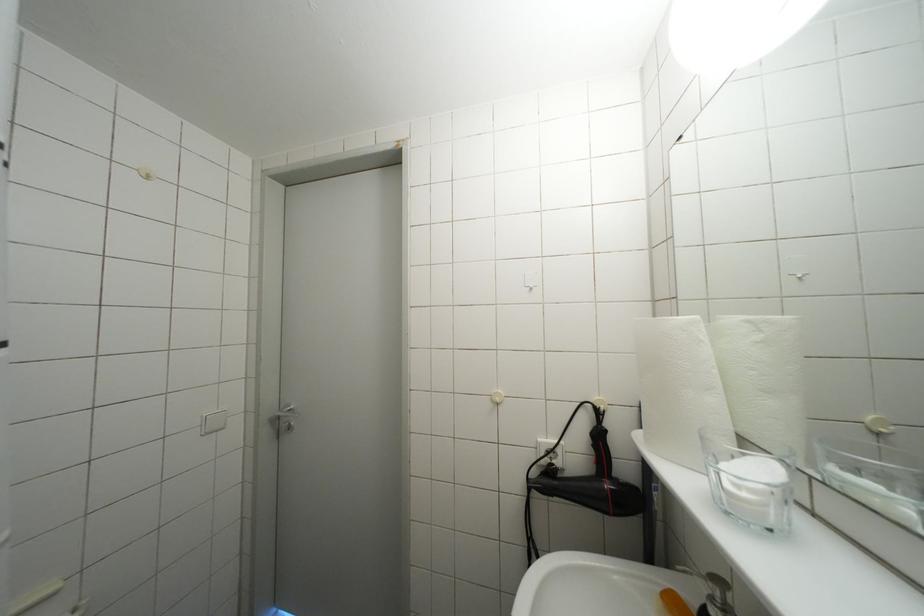
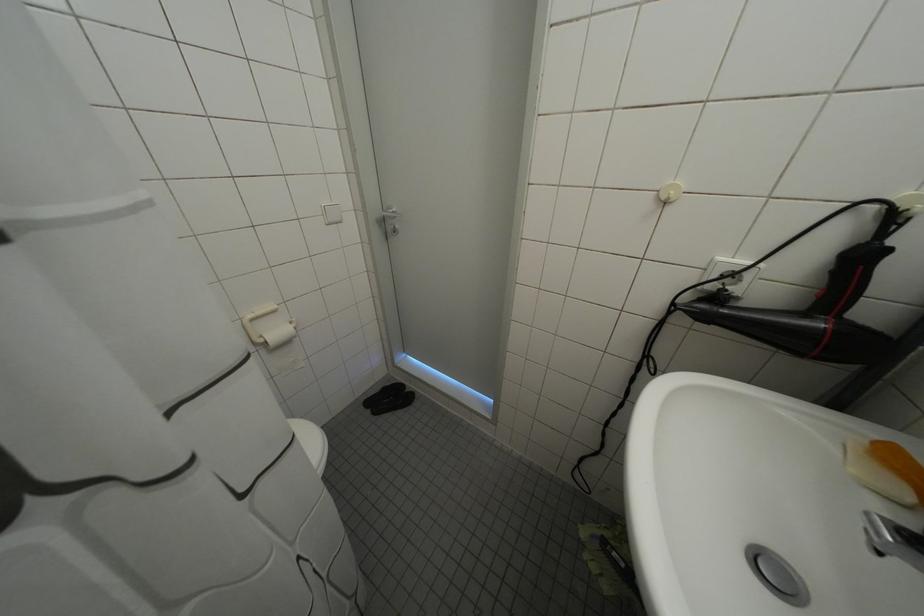
Based on the continuous images, in which direction is the camera rotating?

The camera's rotation is toward left-down.